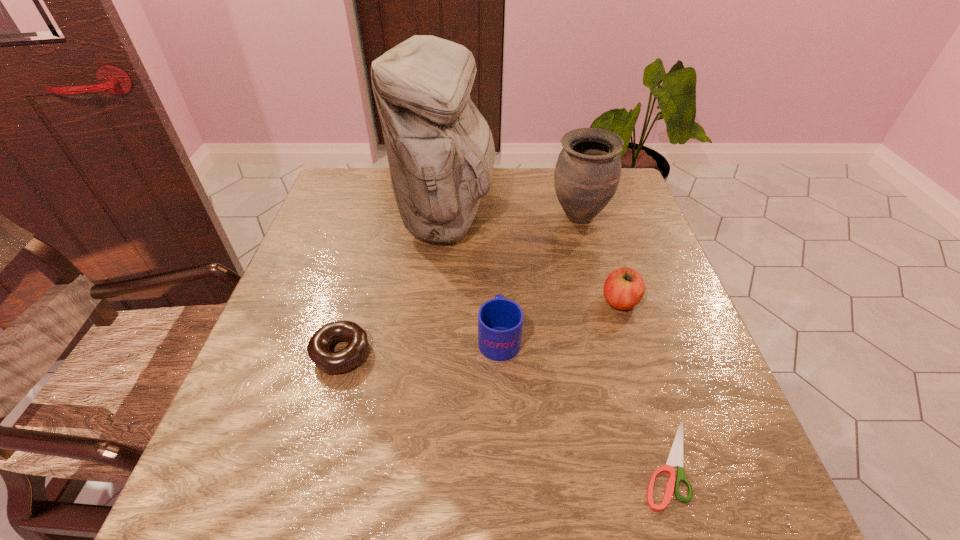
Identify which object is the fifth closest to the second shortest object. Please provide its 2D coordinates. Your answer should be formatted as a tuple, i.e. [(x, y)], where the tuple contains the x and y coordinates of a point satisfying the conditions above.

[(587, 173)]

Image resolution: width=960 pixels, height=540 pixels. In order to click on vacant space that satisfies the following two spatial constraints: 1. on the front-facing side of the tallest object; 2. on the left side of the shortest object in this screenshot , I will do `click(423, 463)`.

Identify the location of vacant area that satisfies the following two spatial constraints: 1. on the front-facing side of the tallest object; 2. on the left side of the scissors. (423, 463).

Find the location of a particular element. free space that satisfies the following two spatial constraints: 1. on the back side of the scissors; 2. on the front-facing side of the backpack is located at coordinates (592, 218).

Where is `free spot that satisfies the following two spatial constraints: 1. on the side with the handle of the mug; 2. on the front-facing side of the tallest object`? free spot that satisfies the following two spatial constraints: 1. on the side with the handle of the mug; 2. on the front-facing side of the tallest object is located at coordinates point(494,218).

You are a GUI agent. You are given a task and a screenshot of the screen. Output one action in this format:
    pyautogui.click(x=<x>, y=<y>)
    Task: Click on the free space that satisfies the following two spatial constraints: 1. on the side with the handle of the apple; 2. on the left side of the mug
    
    Given the screenshot: What is the action you would take?
    pyautogui.click(x=497, y=301)

Where is `vacant area in the image that satisfies the following two spatial constraints: 1. on the front-facing side of the scissors; 2. on the right side of the backpack`? The width and height of the screenshot is (960, 540). vacant area in the image that satisfies the following two spatial constraints: 1. on the front-facing side of the scissors; 2. on the right side of the backpack is located at coordinates click(x=423, y=463).